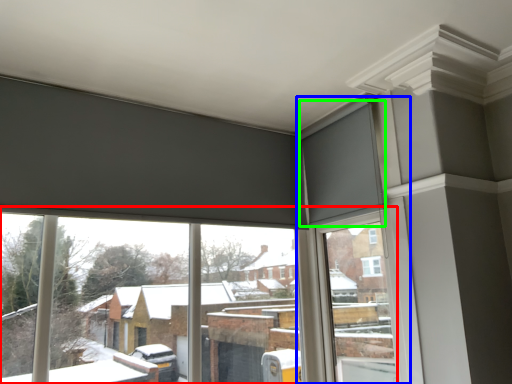
Question: Estimate the real-world distances between objects in this image. Which object is farther from window (highlighted by a red box), window frame (highlighted by a blue box) or curtain (highlighted by a green box)?

Choices:
 (A) window frame
 (B) curtain

Answer: (B)